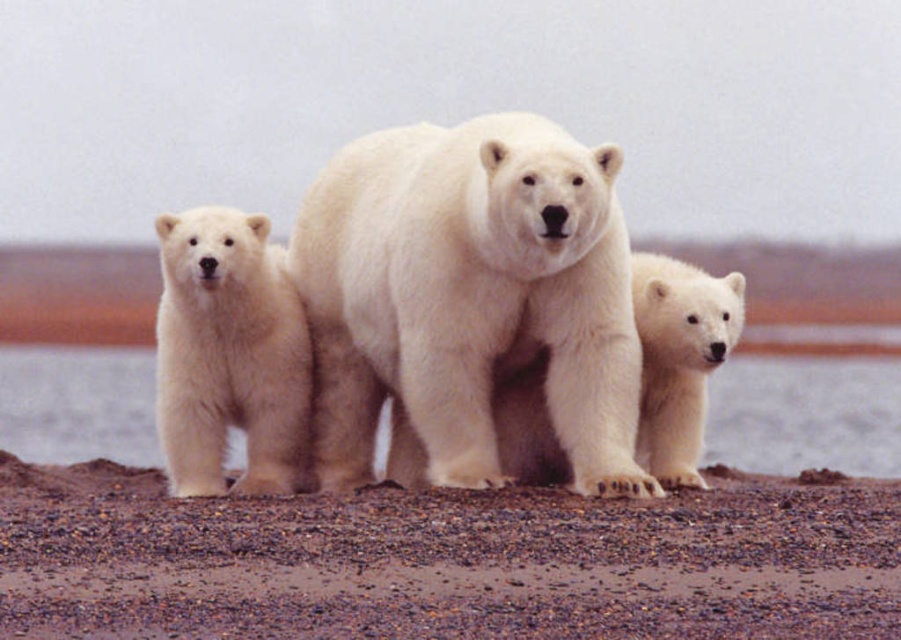
You are a photographer trying to capture a photo of the white fluffy polar bear at left and the white fur water at center. Which object is located lower in the image?

The white fur water at center is located lower than the white fluffy polar bear at left.

You are a photographer trying to capture the polar bears without stepping on the brown gravel at center. If you want to stay as close as possible to the bears while avoiding the gravel, where should you position yourself relative to the bears?

Since the brown gravel at center is located at point (443, 561), you should position yourself either to the left or right side of the bears, away from the central area where the gravel is located, to avoid stepping on it while staying close.